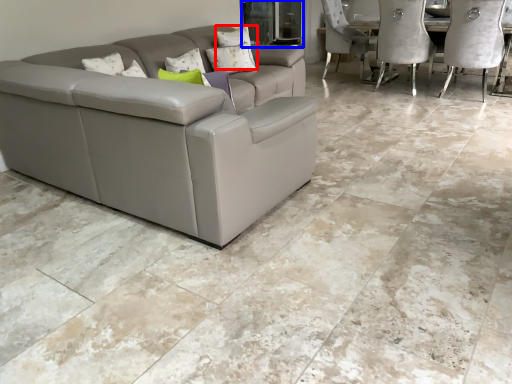
Question: Among these objects, which one is farthest to the camera, pillow (highlighted by a red box) or glass door (highlighted by a blue box)?

Choices:
 (A) pillow
 (B) glass door

Answer: (B)